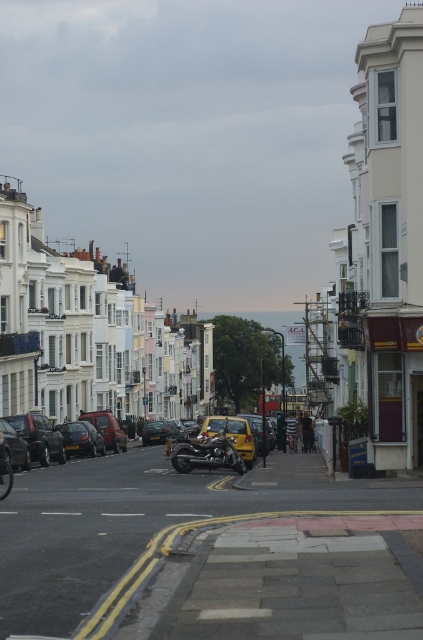
Can you confirm if shiny chrome motorcycle at center is wider than shiny black car at left?

Answer: Yes.

Is the position of shiny chrome motorcycle at center more distant than that of shiny black car at left?

No, shiny chrome motorcycle at center is in front of shiny black car at left.

At what (x,y) coordinates should I click in order to perform the action: click on shiny chrome motorcycle at center. Please return your answer as a coordinate pair (x, y). Looking at the image, I should click on (208, 452).

Does matte black car at center-left have a smaller size compared to shiny black car at center-left?

Actually, matte black car at center-left might be larger than shiny black car at center-left.

Is matte black car at center-left further to the viewer compared to shiny black car at center-left?

No, it is not.

The image size is (423, 640). Describe the element at coordinates (38, 436) in the screenshot. I see `matte black car at center-left` at that location.

The image size is (423, 640). I want to click on matte black car at center-left, so click(x=38, y=436).

Does matte black car at center-left have a smaller size compared to shiny black car at left?

Actually, matte black car at center-left might be larger than shiny black car at left.

Can you confirm if matte black car at center-left is positioned below shiny black car at left?

Yes, matte black car at center-left is below shiny black car at left.

Describe the element at coordinates (38, 436) in the screenshot. The width and height of the screenshot is (423, 640). I see `matte black car at center-left` at that location.

Find the location of a particular element. The image size is (423, 640). matte black car at center-left is located at coordinates (38, 436).